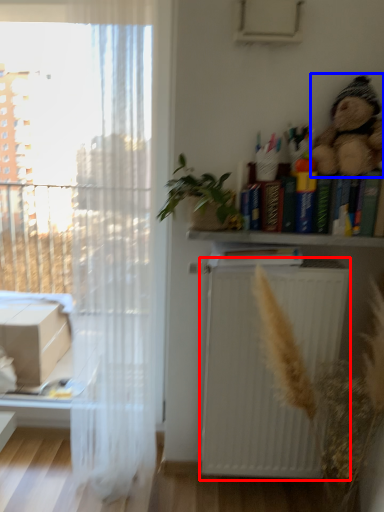
Question: Among these objects, which one is nearest to the camera, radiator (highlighted by a red box) or toy (highlighted by a blue box)?

Choices:
 (A) radiator
 (B) toy

Answer: (B)